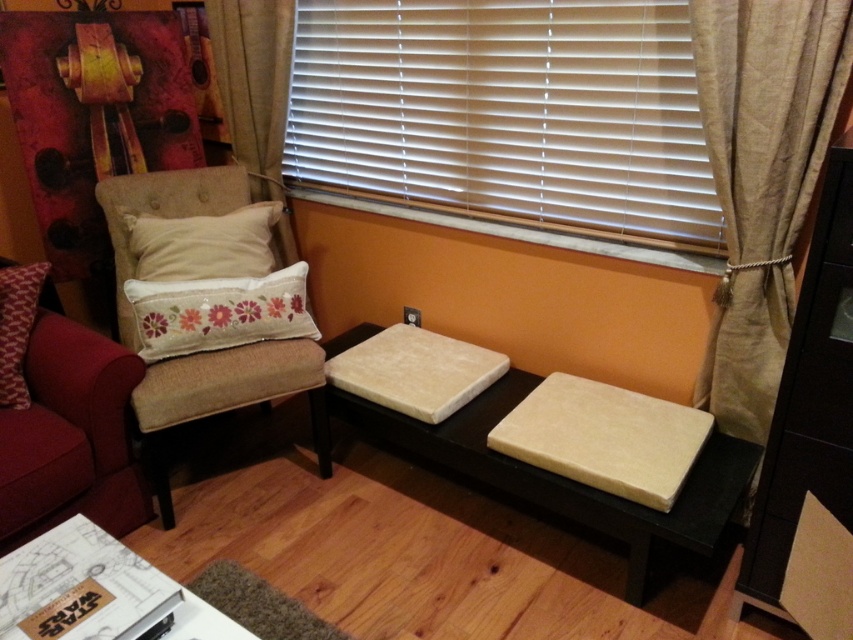
Is beige fabric armchair at left smaller than floral embroidered cushion at center?

Incorrect, beige fabric armchair at left is not smaller in size than floral embroidered cushion at center.

This screenshot has width=853, height=640. I want to click on beige fabric armchair at left, so click(225, 397).

Does beige fabric armchair at left have a greater height compared to red textured pillow at left?

Yes, beige fabric armchair at left is taller than red textured pillow at left.

Does beige fabric armchair at left have a lesser height compared to red textured pillow at left?

No, beige fabric armchair at left is not shorter than red textured pillow at left.

Is point (222, 353) positioned after point (9, 266)?

No, it is not.

You are a GUI agent. You are given a task and a screenshot of the screen. Output one action in this format:
    pyautogui.click(x=<x>, y=<y>)
    Task: Click on the beige fabric armchair at left
    The width and height of the screenshot is (853, 640).
    Given the screenshot: What is the action you would take?
    pyautogui.click(x=225, y=397)

Between beige fabric stool at center and red textured pillow at left, which one is positioned higher?

red textured pillow at left is above.

Can you confirm if beige fabric stool at center is positioned to the right of red textured pillow at left?

Indeed, beige fabric stool at center is positioned on the right side of red textured pillow at left.

The height and width of the screenshot is (640, 853). Identify the location of beige fabric stool at center. (570, 483).

Locate an element on the screen. This screenshot has height=640, width=853. beige fabric stool at center is located at coordinates (570, 483).